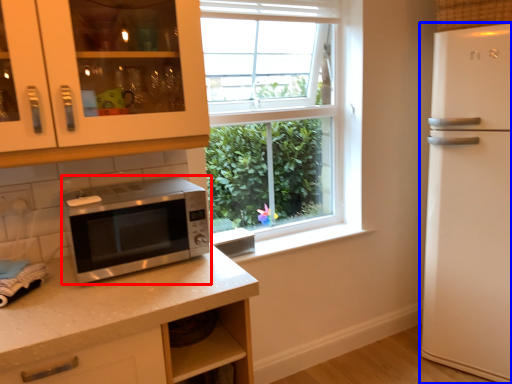
Question: Which object is further to the camera taking this photo, microwave oven (highlighted by a red box) or refrigerator (highlighted by a blue box)?

Choices:
 (A) microwave oven
 (B) refrigerator

Answer: (B)